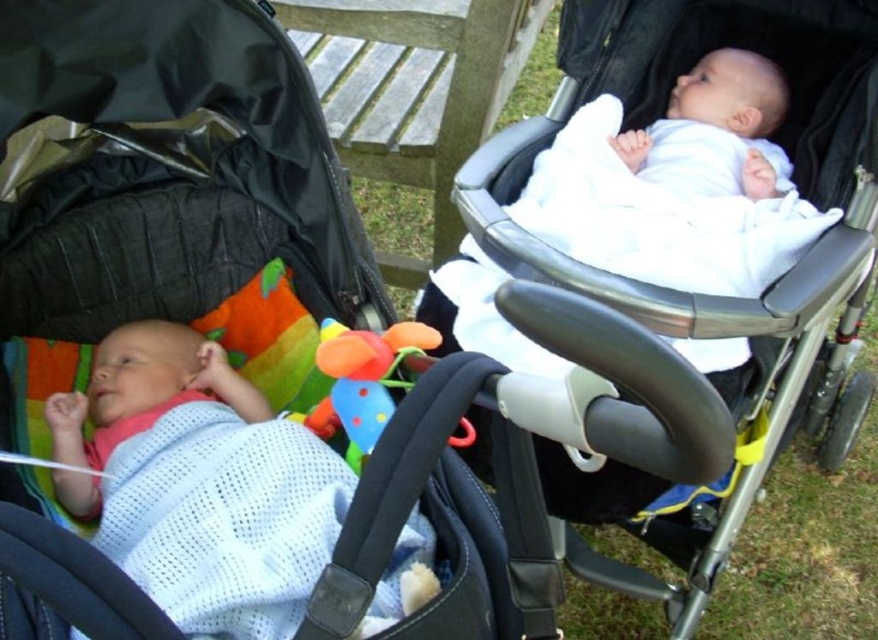
Is point (98, 179) closer to camera compared to point (163, 365)?

No, it is behind (163, 365).

The image size is (878, 640). Find the location of `matte black stroller at left`. matte black stroller at left is located at coordinates tap(168, 188).

I want to click on matte black stroller at left, so click(x=168, y=188).

How far apart are matte black stroller at left and white fabric baby carriage at upper center?

matte black stroller at left and white fabric baby carriage at upper center are 18.20 inches apart from each other.

Consider the image. Who is more distant from viewer, (135, 180) or (471, 186)?

The point (471, 186) is behind.

Locate an element on the screen. This screenshot has height=640, width=878. matte black stroller at left is located at coordinates (168, 188).

Is point (134, 323) farther from camera compared to point (378, 380)?

Yes, point (134, 323) is behind point (378, 380).

Does white knitted fabric baby at left appear on the right side of plastic soft toy at center?

Incorrect, white knitted fabric baby at left is not on the right side of plastic soft toy at center.

Is point (203, 344) farther from camera compared to point (378, 404)?

Yes, it is behind point (378, 404).

Find the location of a particular element. white knitted fabric baby at left is located at coordinates (144, 388).